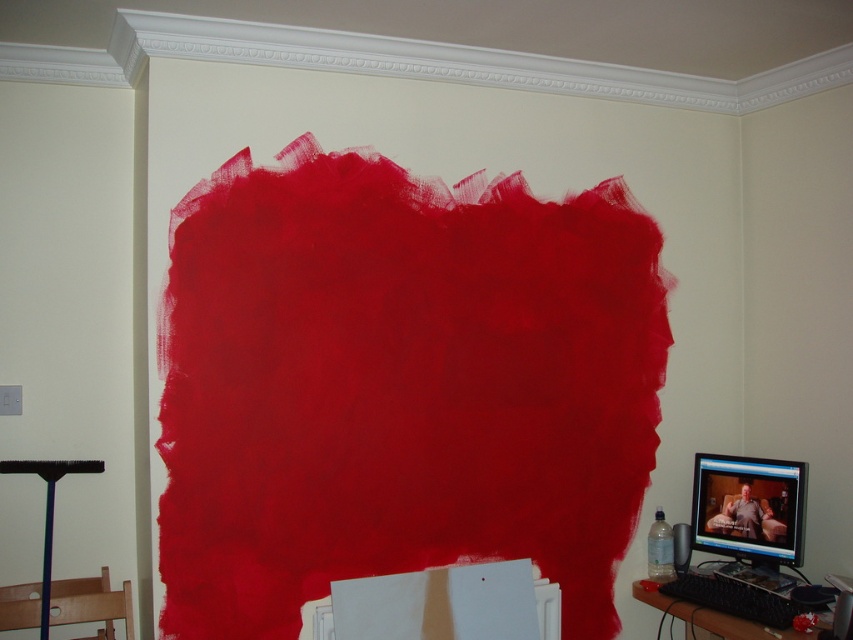
You are a delivery person who needs to place a small package on the desk where the matte black monitor at lower right is located. Based on the coordinates provided, where should you place the package to ensure it doesn not interfere with the monitor?

The matte black monitor at lower right is positioned at coordinates point (749, 508). To avoid interference, place the package away from this point, ensuring it does not overlap with the monitor.

You are standing in the room and want to reach both the matte black monitor at lower right and the matte black brush at lower left. Which object will you encounter first as you move forward?

You will encounter the matte black monitor at lower right first because it is closer to you than the matte black brush at lower left.